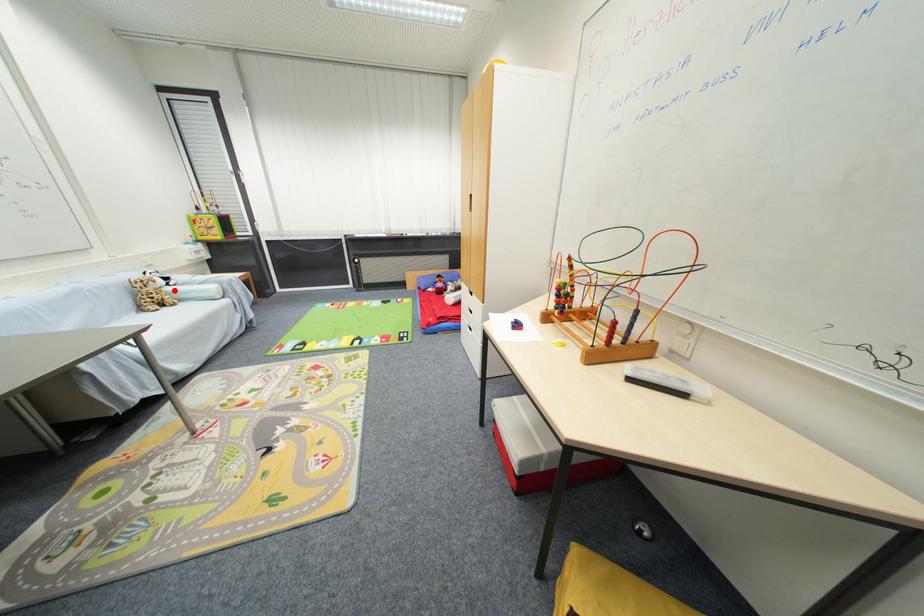
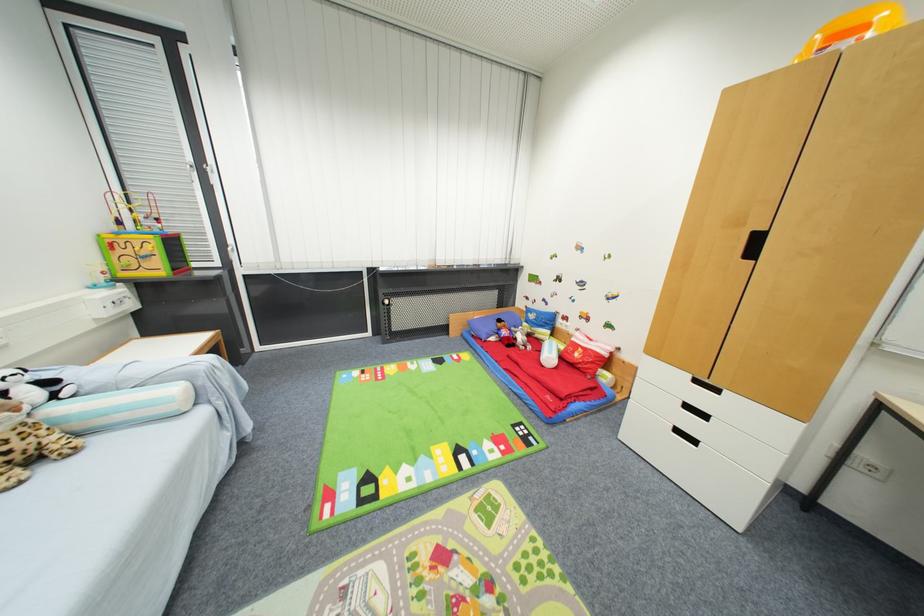
Question: I am providing you with two images of the same scene from different viewpoints. A red point is shown in image1. For the corresponding object point in image2, is it positioned nearer or farther from the camera?

Choices:
 (A) Nearer
 (B) Farther

Answer: (B)